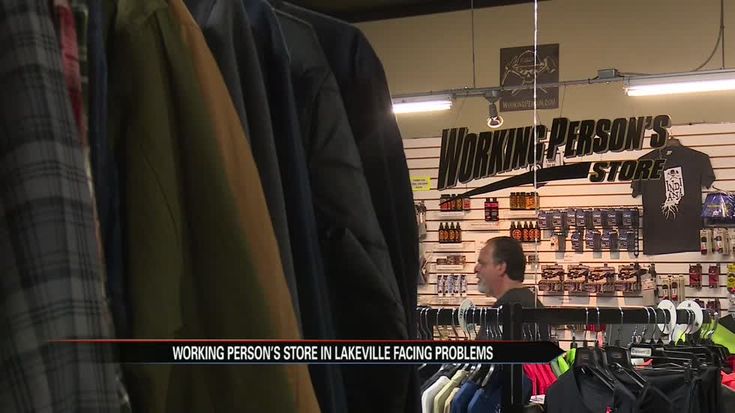
Locate an element on the screen. This screenshot has width=735, height=413. black bottels on walls is located at coordinates (448, 230), (458, 210), (520, 202), (528, 225), (490, 216).